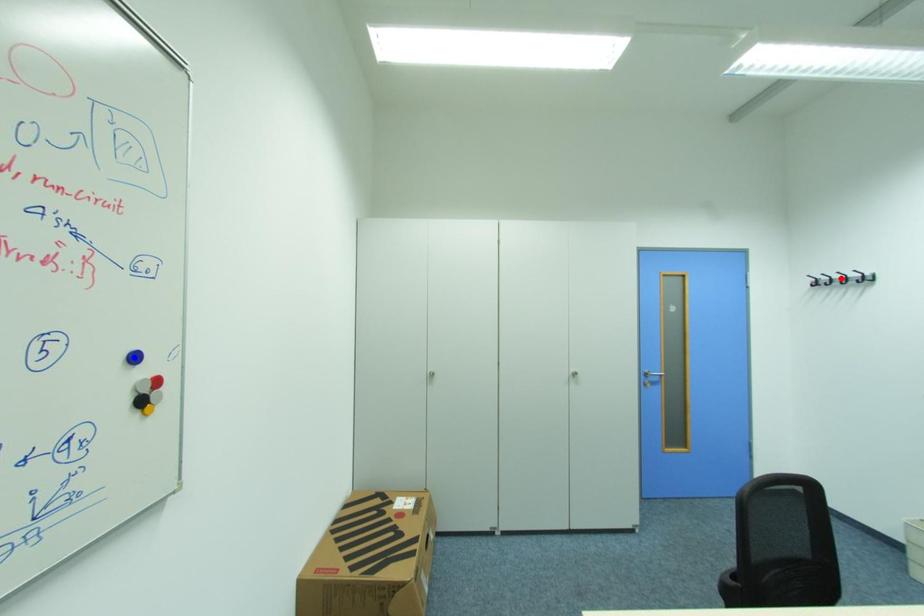
Question: Two points are marked on the image. Which point is closer to the camera?

Choices:
 (A) Blue point is closer.
 (B) Red point is closer.

Answer: (A)